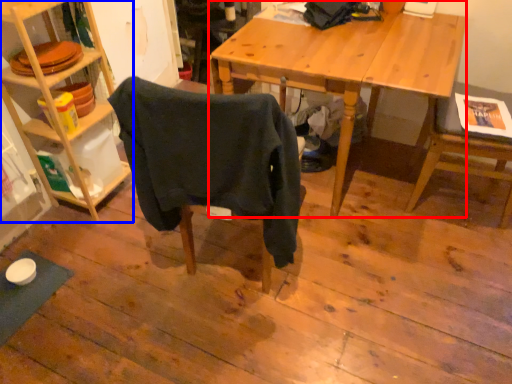
Question: Which of the following is the farthest to the observer, desk (highlighted by a red box) or shelf (highlighted by a blue box)?

Choices:
 (A) desk
 (B) shelf

Answer: (A)